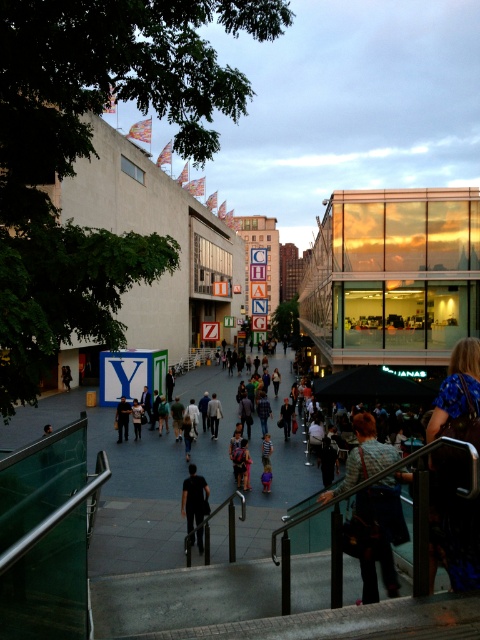
Is point (455, 339) behind point (444, 433)?

Yes, it is behind point (444, 433).

Between point (410, 253) and point (459, 541), which one is positioned in front?

Point (459, 541) is in front.

You are a GUI agent. You are given a task and a screenshot of the screen. Output one action in this format:
    pyautogui.click(x=<x>, y=<y>)
    Task: Click on the beige concrete mall at center
    
    Given the screenshot: What is the action you would take?
    pyautogui.click(x=393, y=275)

Does white concrete mall at left appear on the left side of black matte shirt at center?

Indeed, white concrete mall at left is positioned on the left side of black matte shirt at center.

Describe the element at coordinates (112, 269) in the screenshot. I see `white concrete mall at left` at that location.

This screenshot has height=640, width=480. I want to click on white concrete mall at left, so click(112, 269).

Can you confirm if blue floral shirt at lower right is positioned above black matte shirt at center?

Yes, blue floral shirt at lower right is above black matte shirt at center.

How far apart are blue floral shirt at lower right and black matte shirt at center?

blue floral shirt at lower right is 7.51 meters from black matte shirt at center.

Who is more forward, (462, 388) or (202, 490)?

Point (462, 388) is in front.

Identify the location of blue floral shirt at lower right. The width and height of the screenshot is (480, 640). (456, 518).